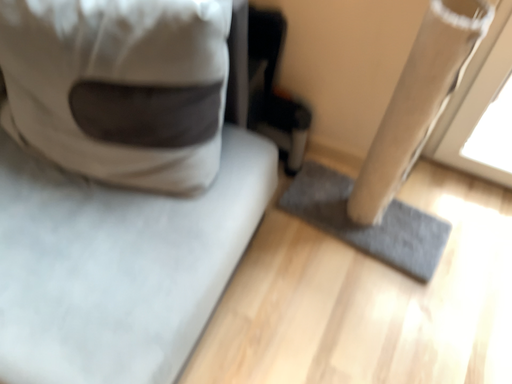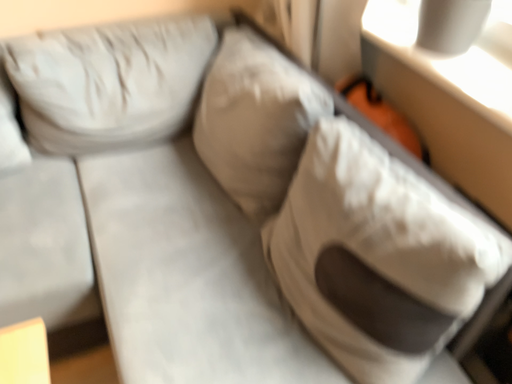
Question: How did the camera likely rotate when shooting the video?

Choices:
 (A) rotated downward
 (B) rotated upward

Answer: (B)